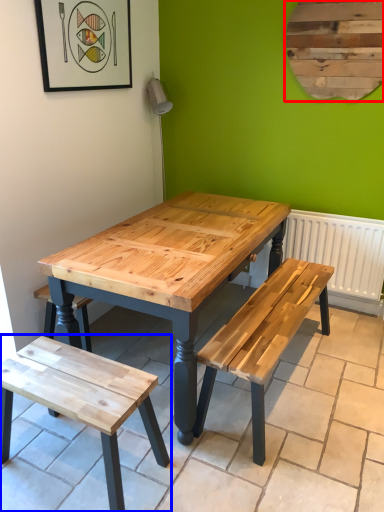
Question: Which of the following is the farthest to the observer, bulletin board (highlighted by a red box) or bench (highlighted by a blue box)?

Choices:
 (A) bulletin board
 (B) bench

Answer: (A)